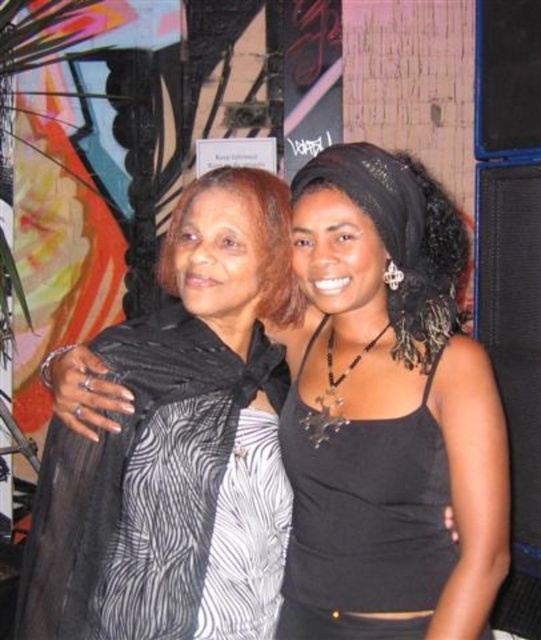
You are a photographer trying to capture a clear shot of both the black matte tank top at center and the matte black scarf at center in the image. Since you want both items to be fully visible in the frame, which one should you focus on first to ensure the taller object is properly framed?

The black matte tank top at center is taller than the matte black scarf at center. Therefore, you should focus on framing the black matte tank top at center first to ensure its full height is captured, then adjust the frame to include the shorter matte black scarf at center.

You are a photographer trying to capture the black matte tank top at center in the image. The camera you are using has a fixed focus point at coordinate (390, 412). Will this focus point align with the black matte tank top at center?

Yes, the point at coordinate (390, 412) indicates the black matte tank top at center, so the focus point will align with it.